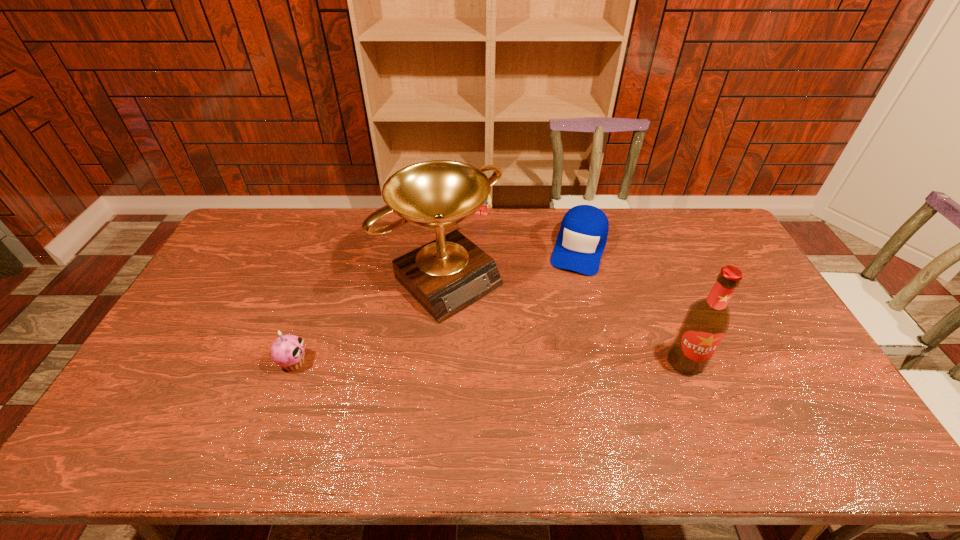
This screenshot has width=960, height=540. In order to click on vacant area situated 0.240m on the front-facing side of the second object from right to left in this screenshot , I will do `click(557, 326)`.

Find the location of a particular element. The image size is (960, 540). vacant point located on the front-facing side of the second object from right to left is located at coordinates (550, 347).

Locate an element on the screen. This screenshot has width=960, height=540. vacant position located on the front-facing side of the second object from right to left is located at coordinates (550, 347).

Where is `vacant space located on the front-facing side of the farthest object`? This screenshot has height=540, width=960. vacant space located on the front-facing side of the farthest object is located at coordinates (471, 240).

I want to click on free space located on the front-facing side of the farthest object, so click(460, 273).

The width and height of the screenshot is (960, 540). In order to click on free spot located on the front-facing side of the farthest object in this screenshot , I will do `click(471, 238)`.

Where is `award situated at the far edge`? award situated at the far edge is located at coordinates (449, 274).

Find the location of a particular element. The height and width of the screenshot is (540, 960). baseball cap that is at the far edge is located at coordinates (582, 238).

You are a GUI agent. You are given a task and a screenshot of the screen. Output one action in this format:
    pyautogui.click(x=<x>, y=<y>)
    Task: Click on the Lego that is at the far edge
    The height and width of the screenshot is (540, 960).
    Given the screenshot: What is the action you would take?
    pyautogui.click(x=483, y=210)

Locate an element on the screen. free point at the far edge is located at coordinates (341, 215).